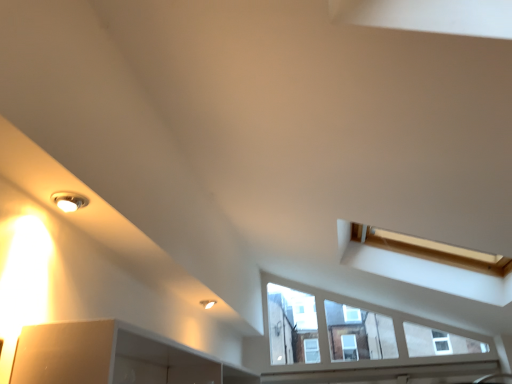
At what (x,y) coordinates should I click in order to perform the action: click on white painted wood at lower center. Please return your answer as a coordinate pair (x, y). This screenshot has height=384, width=512. Looking at the image, I should click on click(x=381, y=372).

What is the approximate height of matte silver light fixture at upper left, arranged as the 2th light fixture when viewed from the right?

It is 1.00 inches.

The image size is (512, 384). What do you see at coordinates (69, 201) in the screenshot?
I see `matte silver light fixture at upper left, which ranks as the 2th light fixture in back-to-front order` at bounding box center [69, 201].

Where is `matte white light fixture at upper left, the first light fixture ordered from the bottom`? Image resolution: width=512 pixels, height=384 pixels. matte white light fixture at upper left, the first light fixture ordered from the bottom is located at coordinates (208, 303).

You are a GUI agent. You are given a task and a screenshot of the screen. Output one action in this format:
    pyautogui.click(x=<x>, y=<y>)
    Task: Click on the white painted wood at lower center
    
    Given the screenshot: What is the action you would take?
    pyautogui.click(x=381, y=372)

From the image's perspective, count 1st light fixtures upward from the white painted wood at lower center and point to it. Please provide its 2D coordinates.

[(208, 303)]

Could you tell me if white painted wood at lower center is facing matte white light fixture at upper left, which ranks as the 1th light fixture in right-to-left order?

No, white painted wood at lower center is not aimed at matte white light fixture at upper left, which ranks as the 1th light fixture in right-to-left order.

Looking at this image, is white painted wood at lower center positioned beyond the bounds of matte white light fixture at upper left, placed as the 2th light fixture when sorted from top to bottom?

That's correct, white painted wood at lower center is outside of matte white light fixture at upper left, placed as the 2th light fixture when sorted from top to bottom.

Considering the positions of objects white painted wood at lower center and matte white light fixture at upper left, the first light fixture ordered from the bottom, in the image provided, who is behind, white painted wood at lower center or matte white light fixture at upper left, the first light fixture ordered from the bottom,?

white painted wood at lower center is more distant.

Is white painted wood at lower center in contact with matte silver light fixture at upper left, marked as the 1th light fixture in a front-to-back arrangement?

No, white painted wood at lower center is not beside matte silver light fixture at upper left, marked as the 1th light fixture in a front-to-back arrangement.

Is white painted wood at lower center oriented away from matte silver light fixture at upper left, which ranks as the 2th light fixture in back-to-front order?

That's not correct — white painted wood at lower center is not looking away from matte silver light fixture at upper left, which ranks as the 2th light fixture in back-to-front order.

Can we say white painted wood at lower center lies outside matte silver light fixture at upper left, marked as the 1th light fixture in a front-to-back arrangement?

Yes, white painted wood at lower center is located beyond the bounds of matte silver light fixture at upper left, marked as the 1th light fixture in a front-to-back arrangement.

Is matte white light fixture at upper left, arranged as the 1th light fixture when viewed from the back, far away from matte silver light fixture at upper left, marked as the 1th light fixture in a top-to-bottom arrangement?

Absolutely, matte white light fixture at upper left, arranged as the 1th light fixture when viewed from the back, is distant from matte silver light fixture at upper left, marked as the 1th light fixture in a top-to-bottom arrangement.

From a real-world perspective, is matte white light fixture at upper left, the first light fixture ordered from the bottom, under matte silver light fixture at upper left, which ranks as the 2th light fixture in back-to-front order?

Yes.

Considering the sizes of objects matte white light fixture at upper left, acting as the second light fixture starting from the front, and matte silver light fixture at upper left, the second light fixture when ordered from bottom to top, in the image provided, who is thinner, matte white light fixture at upper left, acting as the second light fixture starting from the front, or matte silver light fixture at upper left, the second light fixture when ordered from bottom to top,?

Thinner between the two is matte silver light fixture at upper left, the second light fixture when ordered from bottom to top.

Is matte silver light fixture at upper left, which is counted as the first light fixture, starting from the left, facing towards matte white light fixture at upper left, placed as the 2th light fixture when sorted from top to bottom?

No, matte silver light fixture at upper left, which is counted as the first light fixture, starting from the left, is not turned towards matte white light fixture at upper left, placed as the 2th light fixture when sorted from top to bottom.

From the image's perspective, who appears lower, matte silver light fixture at upper left, the second light fixture when ordered from bottom to top, or matte white light fixture at upper left, acting as the second light fixture starting from the front?

matte white light fixture at upper left, acting as the second light fixture starting from the front, appears lower in the image.

Relative to matte white light fixture at upper left, the first light fixture ordered from the bottom, is matte silver light fixture at upper left, marked as the 1th light fixture in a top-to-bottom arrangement, in front or behind?

matte silver light fixture at upper left, marked as the 1th light fixture in a top-to-bottom arrangement, is positioned closer to the viewer than matte white light fixture at upper left, the first light fixture ordered from the bottom.

Is point (60, 203) positioned after point (200, 303)?

No, it is not.

Does point (212, 300) come in front of point (308, 372)?

Yes, it is.

Could you measure the distance between matte white light fixture at upper left, arranged as the 1th light fixture when viewed from the back, and white painted wood at lower center?

matte white light fixture at upper left, arranged as the 1th light fixture when viewed from the back, and white painted wood at lower center are 4.97 feet apart.

Between matte white light fixture at upper left, acting as the second light fixture starting from the front, and white painted wood at lower center, which one is positioned behind?

white painted wood at lower center is more distant.

Is matte white light fixture at upper left, acting as the second light fixture starting from the front, situated inside white painted wood at lower center or outside?

matte white light fixture at upper left, acting as the second light fixture starting from the front, is spatially situated outside white painted wood at lower center.

Is matte silver light fixture at upper left, marked as the 1th light fixture in a top-to-bottom arrangement, aimed at white painted wood at lower center?

No.

Can you confirm if matte silver light fixture at upper left, marked as the 1th light fixture in a top-to-bottom arrangement, is shorter than white painted wood at lower center?

Indeed, matte silver light fixture at upper left, marked as the 1th light fixture in a top-to-bottom arrangement, has a lesser height compared to white painted wood at lower center.

Is matte silver light fixture at upper left, arranged as the 2th light fixture when viewed from the right, at the left side of white painted wood at lower center?

Correct, you'll find matte silver light fixture at upper left, arranged as the 2th light fixture when viewed from the right, to the left of white painted wood at lower center.

Can we say matte silver light fixture at upper left, marked as the 1th light fixture in a top-to-bottom arrangement, lies outside white painted wood at lower center?

Yes, matte silver light fixture at upper left, marked as the 1th light fixture in a top-to-bottom arrangement, is located beyond the bounds of white painted wood at lower center.

Locate an element on the screen. window sill beneath the matte white light fixture at upper left, the second light fixture viewed from the left (from a real-world perspective) is located at coordinates (381, 372).

The width and height of the screenshot is (512, 384). What are the coordinates of `the 2nd light fixture counting from the left side of the white painted wood at lower center` in the screenshot? It's located at (69, 201).

Based on their spatial positions, is matte white light fixture at upper left, placed as the 2th light fixture when sorted from top to bottom, or matte silver light fixture at upper left, arranged as the 2th light fixture when viewed from the right, further from white painted wood at lower center?

matte silver light fixture at upper left, arranged as the 2th light fixture when viewed from the right, is positioned further to the anchor white painted wood at lower center.

When comparing their distances from matte white light fixture at upper left, the first light fixture ordered from the bottom, does white painted wood at lower center or matte silver light fixture at upper left, marked as the 1th light fixture in a top-to-bottom arrangement, seem closer?

The object closer to matte white light fixture at upper left, the first light fixture ordered from the bottom, is matte silver light fixture at upper left, marked as the 1th light fixture in a top-to-bottom arrangement.

Based on their spatial positions, is matte silver light fixture at upper left, the second light fixture when ordered from bottom to top, or white painted wood at lower center closer to matte white light fixture at upper left, the second light fixture viewed from the left?

Among the two, matte silver light fixture at upper left, the second light fixture when ordered from bottom to top, is located nearer to matte white light fixture at upper left, the second light fixture viewed from the left.

Based on their spatial positions, is matte silver light fixture at upper left, which is counted as the first light fixture, starting from the left, or matte white light fixture at upper left, arranged as the 1th light fixture when viewed from the back, closer to white painted wood at lower center?

matte white light fixture at upper left, arranged as the 1th light fixture when viewed from the back, lies closer to white painted wood at lower center than the other object.

When comparing their distances from matte silver light fixture at upper left, which is counted as the first light fixture, starting from the left, does matte white light fixture at upper left, which ranks as the 1th light fixture in right-to-left order, or white painted wood at lower center seem further?

white painted wood at lower center is further to matte silver light fixture at upper left, which is counted as the first light fixture, starting from the left.

In the scene shown: Estimate the real-world distances between objects in this image. Which object is further from matte silver light fixture at upper left, marked as the 1th light fixture in a top-to-bottom arrangement, white painted wood at lower center or matte white light fixture at upper left, arranged as the 1th light fixture when viewed from the back?

white painted wood at lower center lies further to matte silver light fixture at upper left, marked as the 1th light fixture in a top-to-bottom arrangement, than the other object.

Locate an element on the screen. The height and width of the screenshot is (384, 512). light fixture between matte silver light fixture at upper left, marked as the 1th light fixture in a front-to-back arrangement, and white painted wood at lower center from front to back is located at coordinates (208, 303).